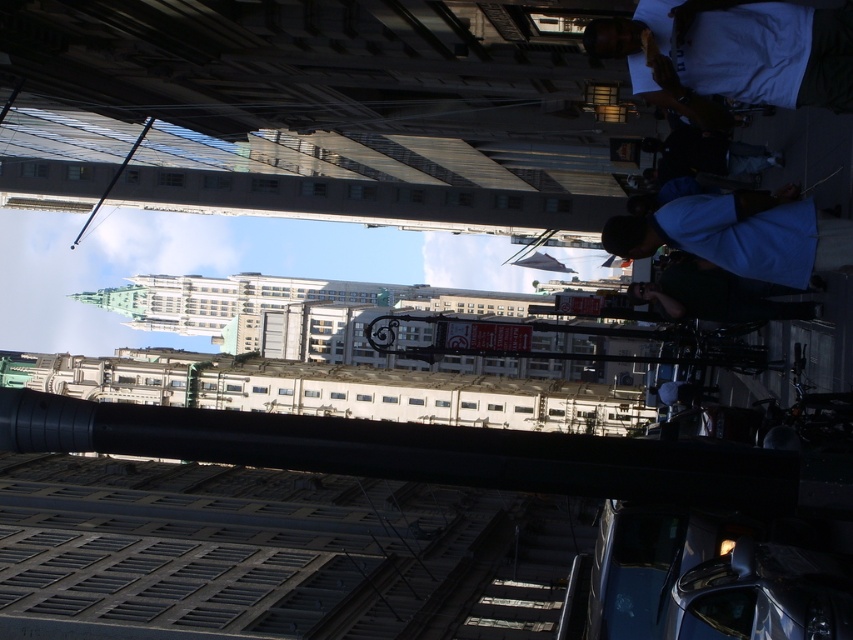
Is point (456, 532) farther from viewer compared to point (756, 3)?

Yes, it is.

Which is below, metallic gray train track at lower center or white cotton shirt at upper right?

metallic gray train track at lower center

Image resolution: width=853 pixels, height=640 pixels. Find the location of `metallic gray train track at lower center`. metallic gray train track at lower center is located at coordinates (473, 577).